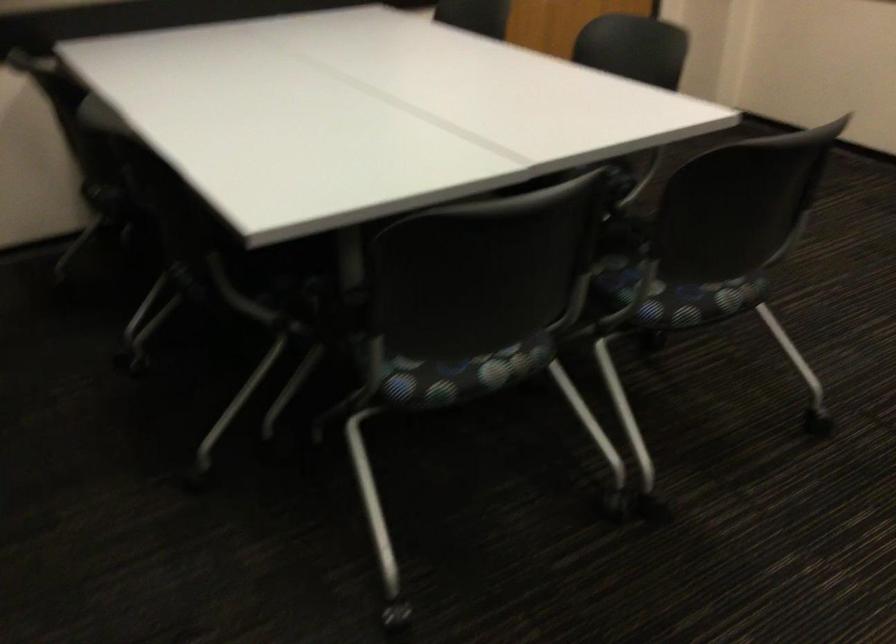
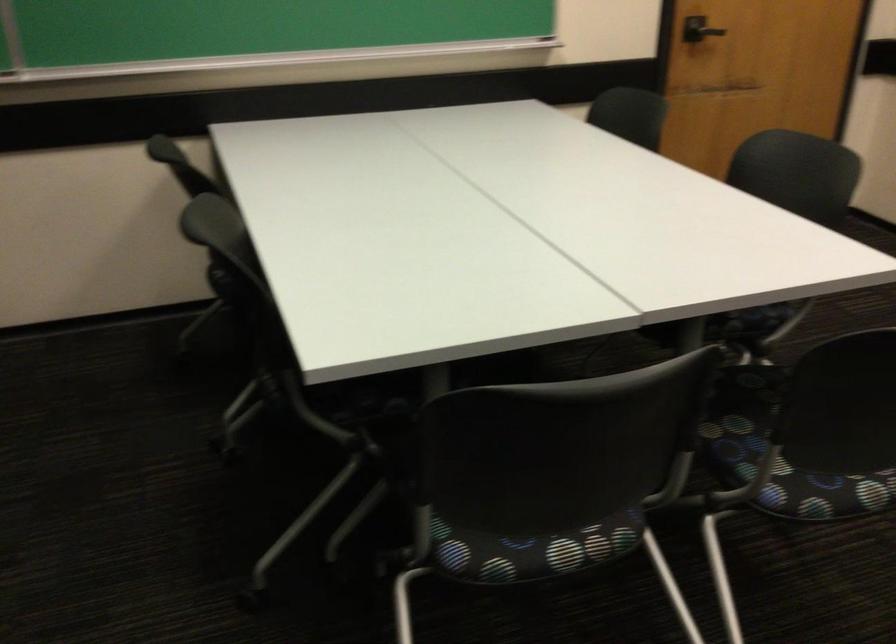
What movement of the cameraman would produce the second image?

The cameraman walked toward right, forward.